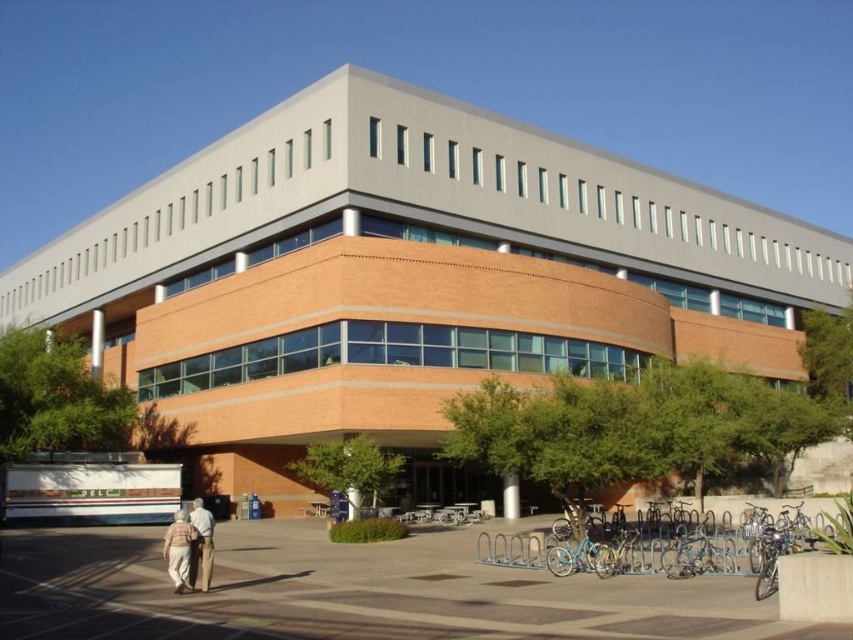
Question: Is light brown pants at lower left above light beige fabric pants at lower left?

Choices:
 (A) no
 (B) yes

Answer: (B)

Question: Which is farther from the light beige fabric pants at lower left?

Choices:
 (A) blue metallic bicycle at lower right
 (B) light brown pants at lower left
 (C) brick building at center

Answer: (C)

Question: Which point is farther to the camera?

Choices:
 (A) blue metallic bicycle at lower right
 (B) brick building at center
 (C) light brown pants at lower left
 (D) light beige fabric pants at lower left

Answer: (B)

Question: Can you confirm if brick building at center is positioned above blue metallic bicycle at lower right?

Choices:
 (A) no
 (B) yes

Answer: (B)

Question: Does brick building at center appear over light brown pants at lower left?

Choices:
 (A) yes
 (B) no

Answer: (A)

Question: Which point is farther to the camera?

Choices:
 (A) (209, 557)
 (B) (674, 528)
 (C) (132, 372)
 (D) (183, 580)

Answer: (C)